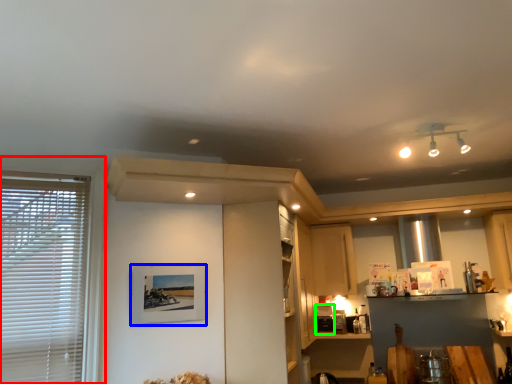
Question: Considering the real-world distances, which object is farthest from window (highlighted by a red box)? picture frame (highlighted by a blue box) or appliance (highlighted by a green box)?

Choices:
 (A) picture frame
 (B) appliance

Answer: (B)